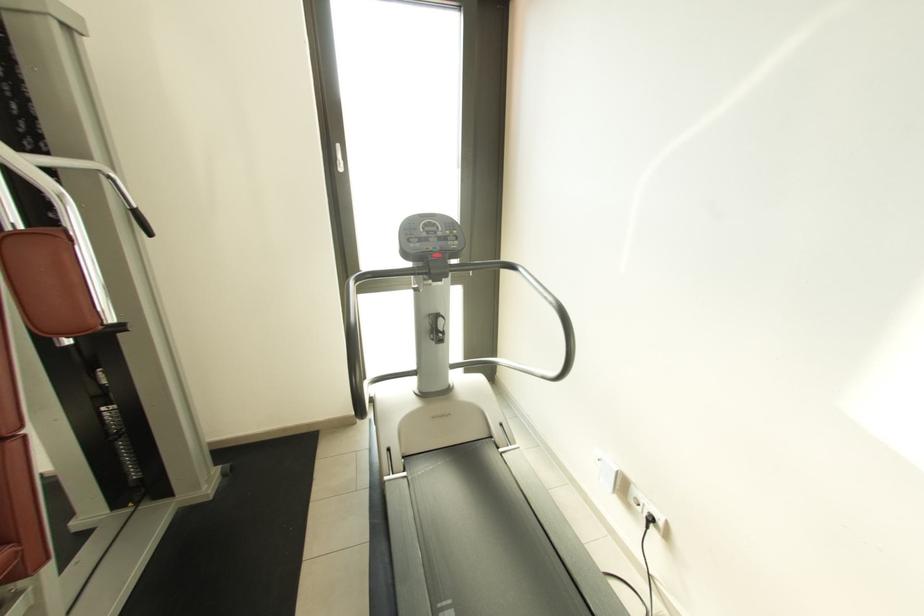
Identify the location of black power plug. (650, 517).